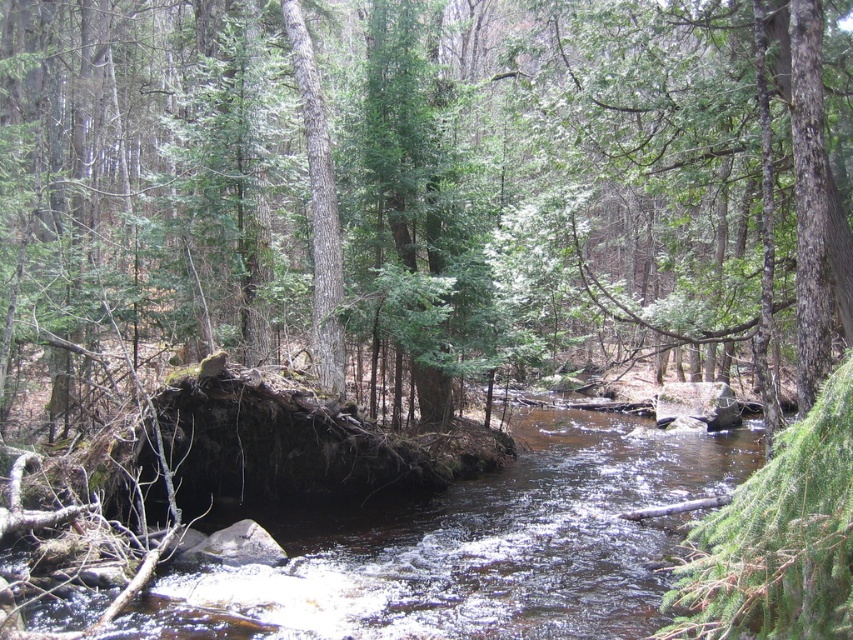
Consider the image. You are a hiker trying to cross the stream in the forest. You spot two points in the stream marked as point 1 and point 2. Point 1 is at coordinates point (x=248, y=358) and point 2 is at point (x=445, y=572). Which point is closer to you as you stand on the bank?

Point (x=248, y=358) is closer to you because it is further to the camera than point (x=445, y=572), meaning it is nearer in the stream.